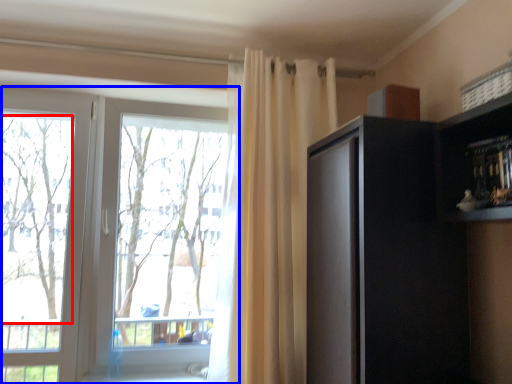
Question: Which of the following is the closest to the observer, tree (highlighted by a red box) or window (highlighted by a blue box)?

Choices:
 (A) tree
 (B) window

Answer: (B)